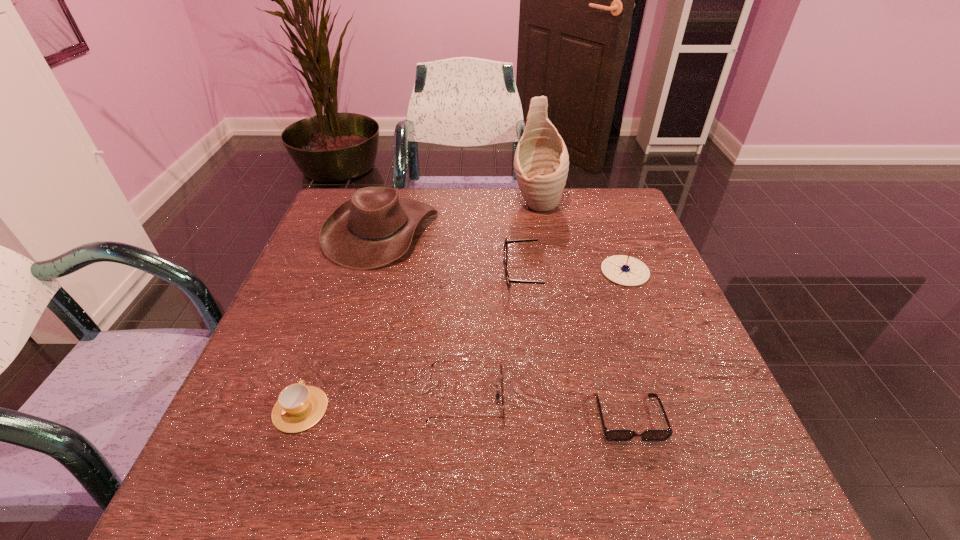
The image size is (960, 540). Find the location of `vacant area situated 0.130m on the front-facing side of the spectacles`. vacant area situated 0.130m on the front-facing side of the spectacles is located at coordinates (449, 275).

Locate an element on the screen. vacant space located on the front-facing side of the spectacles is located at coordinates (444, 275).

You are a GUI agent. You are given a task and a screenshot of the screen. Output one action in this format:
    pyautogui.click(x=<x>, y=<y>)
    Task: Click on the vacant position located on the front-facing side of the spectacles
    The image size is (960, 540).
    Given the screenshot: What is the action you would take?
    pyautogui.click(x=453, y=275)

Locate an element on the screen. This screenshot has height=540, width=960. vacant point located 0.250m with the handle on the side of the cup is located at coordinates (340, 296).

The image size is (960, 540). I want to click on vacant region located 0.270m with the handle on the side of the cup, so click(342, 290).

Locate an element on the screen. This screenshot has height=540, width=960. free spot located 0.080m with the handle on the side of the cup is located at coordinates [x=320, y=354].

Find the location of a particular element. This screenshot has width=960, height=540. free space located 0.190m on the front-facing side of the fifth object from right to left is located at coordinates (605, 397).

You are a GUI agent. You are given a task and a screenshot of the screen. Output one action in this format:
    pyautogui.click(x=<x>, y=<y>)
    Task: Click on the vacant region located 0.070m on the front-facing side of the right sunglasses
    The height and width of the screenshot is (540, 960).
    Given the screenshot: What is the action you would take?
    pyautogui.click(x=648, y=486)

Find the location of a particular element. pitcher present at the far edge is located at coordinates (541, 162).

Where is `cowboy hat that is positioned at the far edge`? The width and height of the screenshot is (960, 540). cowboy hat that is positioned at the far edge is located at coordinates (373, 228).